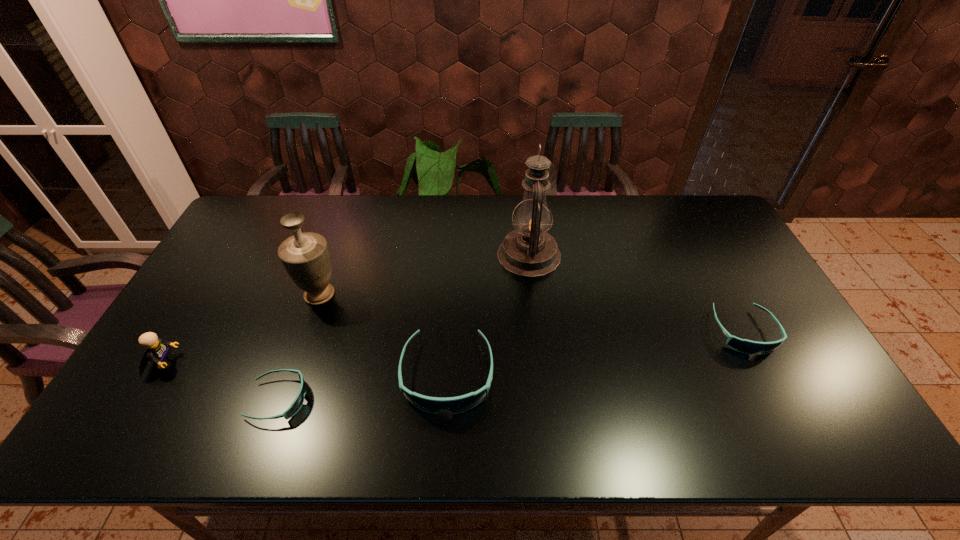
You are a GUI agent. You are given a task and a screenshot of the screen. Output one action in this format:
    pyautogui.click(x=<x>, y=<y>)
    Task: Click on the vacant space that's between the farthest object and the second tallest sunglasses
    The height and width of the screenshot is (540, 960).
    Given the screenshot: What is the action you would take?
    pyautogui.click(x=636, y=293)

Locate an element on the screen. Image resolution: width=960 pixels, height=540 pixels. empty location between the rightmost sunglasses and the oil lamp is located at coordinates (636, 293).

Locate an element on the screen. Image resolution: width=960 pixels, height=540 pixels. blank region between the tallest object and the rightmost sunglasses is located at coordinates (636, 293).

Where is `vacant space that is in between the shortest object and the third object from right to left`? vacant space that is in between the shortest object and the third object from right to left is located at coordinates (363, 387).

The width and height of the screenshot is (960, 540). I want to click on empty location between the rightmost sunglasses and the shortest object, so click(x=511, y=366).

Image resolution: width=960 pixels, height=540 pixels. I want to click on free spot between the fifth shortest object and the second shortest sunglasses, so click(532, 313).

Where is `empty space that is in between the shortest object and the second tallest sunglasses`? empty space that is in between the shortest object and the second tallest sunglasses is located at coordinates (511, 366).

At what (x,y) coordinates should I click in order to perform the action: click on object that is the fourth closest one to the fifth tallest object. Please return your answer as a coordinate pair (x, y). Image resolution: width=960 pixels, height=540 pixels. Looking at the image, I should click on (298, 402).

Identify which object is located as the fifth nearest to the oil lamp. Please provide its 2D coordinates. Your answer should be formatted as a tuple, i.e. [(x, y)], where the tuple contains the x and y coordinates of a point satisfying the conditions above.

[(157, 351)]

Find the location of a particular element. This screenshot has height=540, width=960. the second closest sunglasses relative to the rightmost object is located at coordinates (298, 402).